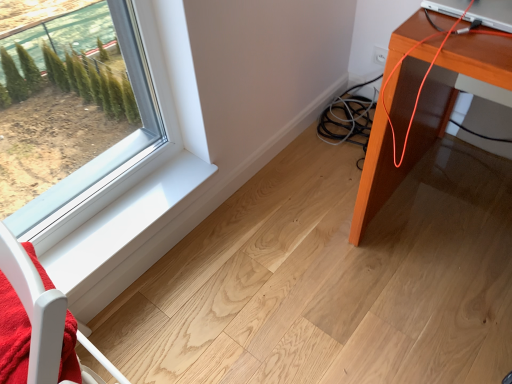
This screenshot has width=512, height=384. I want to click on vacant space underneath orange wood table at right (from a real-world perspective), so click(456, 215).